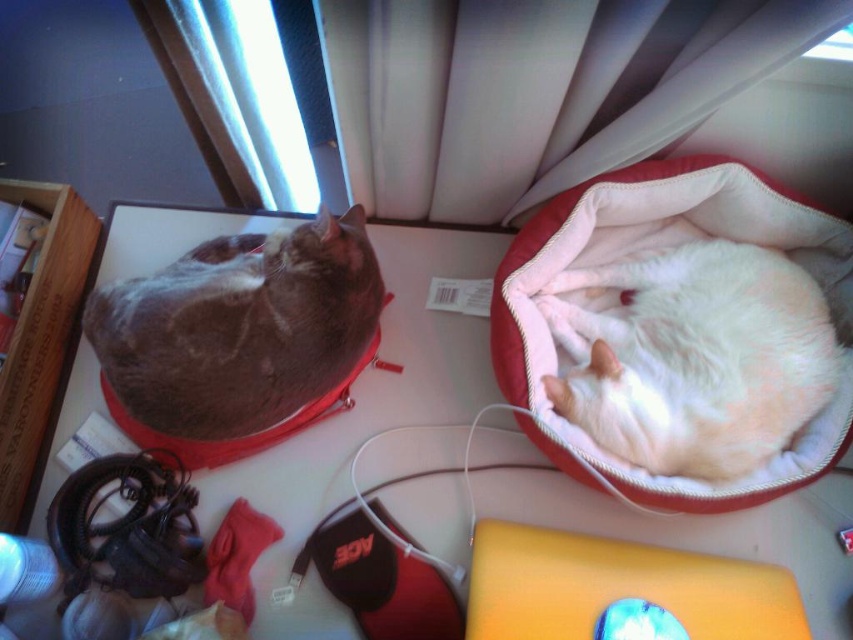
You are organizing a play area for the cats and want to ensure they can see each other across the room. Given their positions relative to the white glossy table at center, can the brown tabby cat at lower left and the white fluffy cat at center see each other without obstruction?

→ The white fluffy cat at center is behind the white glossy table at center, so the brown tabby cat at lower left and the white fluffy cat at center cannot see each other clearly due to the table obstructing their line of sight.

You are a cat owner who wants to place a new toy on the white glossy table at center. If you are standing 39.30 inches away from the table, can you easily reach it?

The white glossy table at center is 39.30 inches away from the viewer, which is about 3.28 feet. Since most people have an arm span longer than 3 feet, you can easily reach the table from that distance.

You are organizing a toy for a cat. You have a small toy that needs to be placed on the white glossy table at center. However, you want to ensure it won not be knocked off by the gray fur cat at left. Based on their positions, is the table far enough away from the cat to prevent this?

The white glossy table at center is to the right of the gray fur cat at left, so placing the toy there should be safe as it is positioned away from the cat.